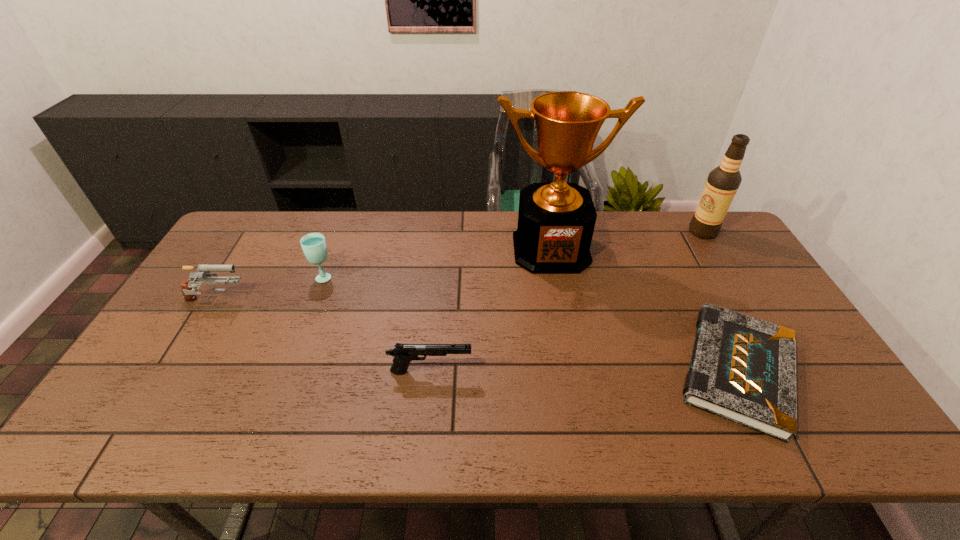
The width and height of the screenshot is (960, 540). I want to click on free space at the far right corner, so click(x=719, y=239).

Find the location of a particular element. free area in between the farther gun and the shortest object is located at coordinates coord(476,336).

Where is `free space that is in between the fifth object from right to left and the alcohol`? free space that is in between the fifth object from right to left and the alcohol is located at coordinates (514, 254).

Where is `unoccupied position between the fifth shortest object and the taller gun`? The height and width of the screenshot is (540, 960). unoccupied position between the fifth shortest object and the taller gun is located at coordinates (459, 267).

I want to click on vacant area that lies between the left gun and the alcohol, so click(459, 267).

This screenshot has height=540, width=960. I want to click on unoccupied position between the shortest object and the fourth object from left to right, so click(644, 309).

Image resolution: width=960 pixels, height=540 pixels. In order to click on vacant area that lies between the alcohol and the third object from left to right in this screenshot , I will do `click(566, 302)`.

At what (x,y) coordinates should I click in order to perform the action: click on free space between the leftmost object and the alcohol. Please return your answer as a coordinate pair (x, y). The width and height of the screenshot is (960, 540). Looking at the image, I should click on (459, 267).

Find the location of a particular element. This screenshot has width=960, height=540. free space between the shorter gun and the shortest object is located at coordinates (584, 371).

This screenshot has height=540, width=960. In order to click on vacant point located between the glass and the leftmost object in this screenshot , I will do `click(270, 289)`.